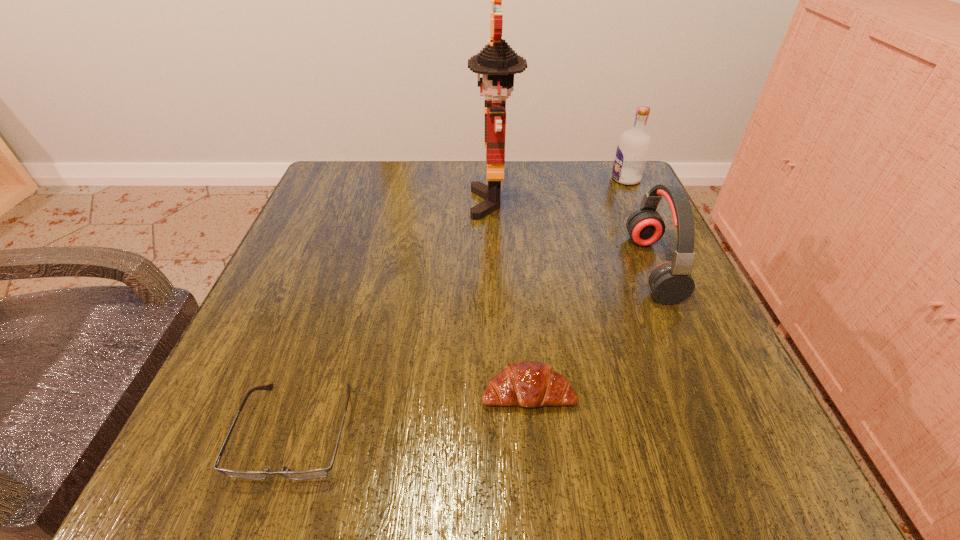
The width and height of the screenshot is (960, 540). What are the coordinates of `free space located 0.260m on the label of the vodka` in the screenshot? It's located at (506, 179).

I want to click on free space located 0.080m on the label of the vodka, so click(579, 179).

Find the location of a particular element. Image resolution: width=960 pixels, height=540 pixels. blank space located 0.340m on the ear cups of the earphone is located at coordinates (459, 268).

Locate an element on the screen. The height and width of the screenshot is (540, 960). vacant region located 0.130m on the ear cups of the earphone is located at coordinates (567, 268).

Locate an element on the screen. The width and height of the screenshot is (960, 540). free space located on the ear cups of the earphone is located at coordinates (578, 268).

Where is `free space located 0.060m on the back of the crescent roll`? Image resolution: width=960 pixels, height=540 pixels. free space located 0.060m on the back of the crescent roll is located at coordinates (523, 341).

What are the coordinates of `nutcracker at the far edge` in the screenshot? It's located at (497, 62).

Where is `vodka that is at the far edge`? vodka that is at the far edge is located at coordinates (633, 148).

Where is `object situated at the near edge`? object situated at the near edge is located at coordinates (318, 473).

Locate an element on the screen. The height and width of the screenshot is (540, 960). object positioned at the left edge is located at coordinates pos(318,473).